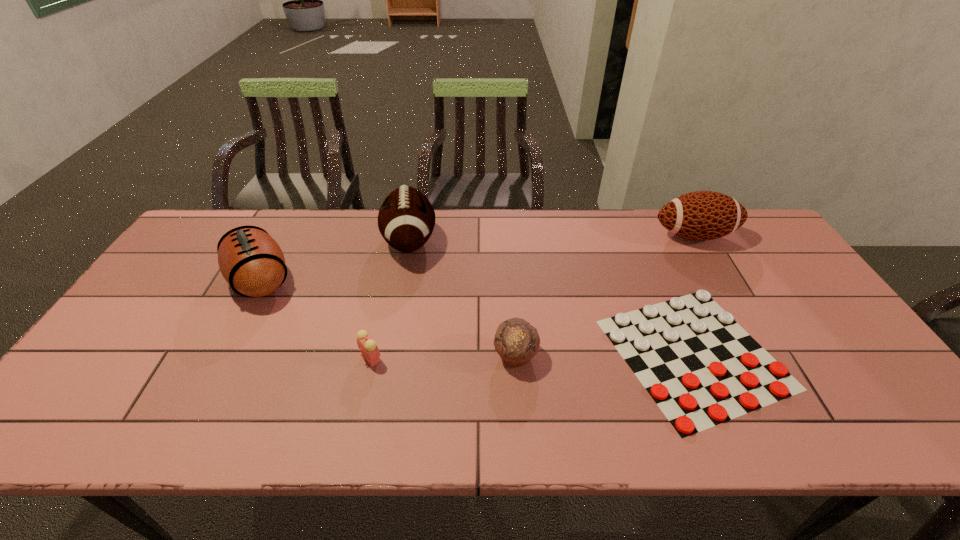
You are a GUI agent. You are given a task and a screenshot of the screen. Output one action in this format:
    pyautogui.click(x=<x>, y=<y>)
    Task: Click on the second football (American) from right to left
    This screenshot has height=540, width=960.
    Given the screenshot: What is the action you would take?
    pyautogui.click(x=406, y=219)

Locate an element on the screen. This screenshot has height=540, width=960. the rightmost football (American) is located at coordinates (702, 215).

The image size is (960, 540). Identify the location of the leftmost object. (251, 261).

What are the coordinates of `the fourth object from left to right` in the screenshot? It's located at (516, 341).

Identify the location of muffin. This screenshot has width=960, height=540. (516, 341).

The image size is (960, 540). What are the coordinates of `the second shortest object` in the screenshot? It's located at (367, 346).

The image size is (960, 540). I want to click on the shortest object, so click(701, 368).

Identify the location of vacant space situated 0.400m on the left of the second football (American) from left to right. (258, 241).

The height and width of the screenshot is (540, 960). I want to click on free spot located on the front of the rightmost football (American), so click(x=711, y=265).

What are the coordinates of `vacant region located 0.150m on the back of the leftmost football (American)` in the screenshot? It's located at (290, 225).